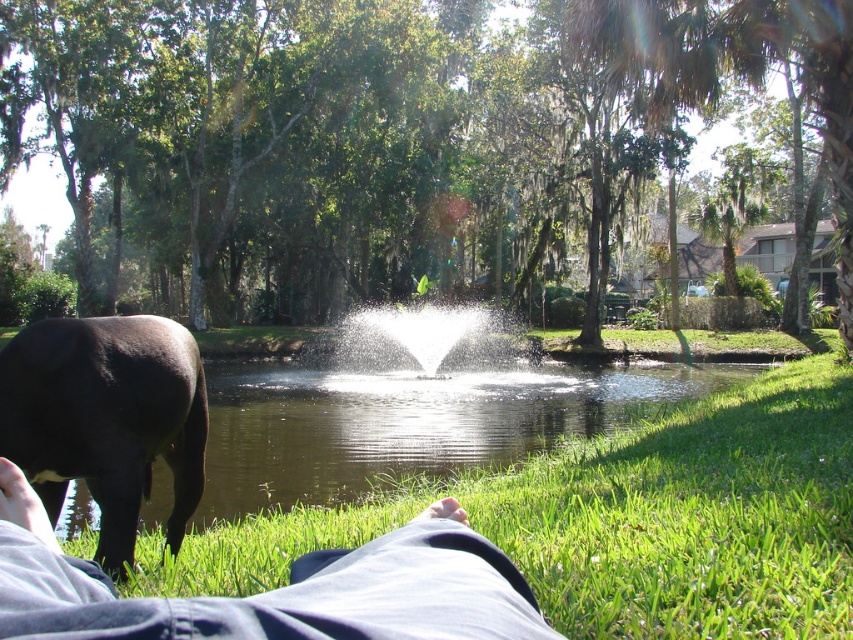
Question: Which point appears farthest from the camera in this image?

Choices:
 (A) (187, 632)
 (B) (404, 330)
 (C) (192, 480)

Answer: (B)

Question: Can you confirm if green grassy pond at center is positioned below denim pants at lower left?

Choices:
 (A) yes
 (B) no

Answer: (A)

Question: Can you confirm if green grassy pond at center is positioned below white frothy water at center?

Choices:
 (A) yes
 (B) no

Answer: (A)

Question: Which of the following is the closest to the observer?

Choices:
 (A) (384, 554)
 (B) (59, 352)
 (C) (502, 362)

Answer: (A)

Question: Estimate the real-world distances between objects in this image. Which object is farther from the black glossy bull at lower left?

Choices:
 (A) white frothy water at center
 (B) green grassy pond at center
 (C) denim pants at lower left

Answer: (A)

Question: Does green grassy pond at center appear on the left side of white frothy water at center?

Choices:
 (A) yes
 (B) no

Answer: (A)